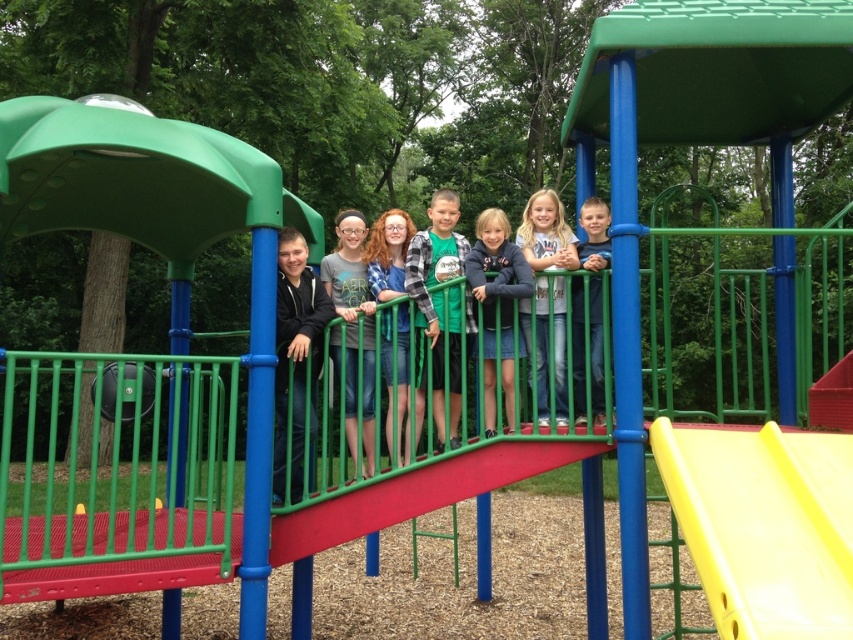
Question: Which object appears closest to the camera in this image?

Choices:
 (A) yellow plastic slide at right
 (B) white matte shirt at center

Answer: (A)

Question: Is green plaid shirt at center further to the viewer compared to white matte shirt at center?

Choices:
 (A) yes
 (B) no

Answer: (B)

Question: Considering the relative positions of matte black hoodie at left and gray matte shirt at center in the image provided, where is matte black hoodie at left located with respect to gray matte shirt at center?

Choices:
 (A) right
 (B) left

Answer: (B)

Question: Considering the real-world distances, which object is closest to the dark blue shirt at center?

Choices:
 (A) dark blue denim skirt at center
 (B) white matte shirt at center
 (C) gray matte shirt at center

Answer: (B)

Question: Where is white matte shirt at center located in relation to dark blue denim skirt at center in the image?

Choices:
 (A) right
 (B) left

Answer: (A)

Question: Which point is closer to the camera?

Choices:
 (A) yellow plastic slide at right
 (B) white matte shirt at center
 (C) gray matte shirt at center

Answer: (A)